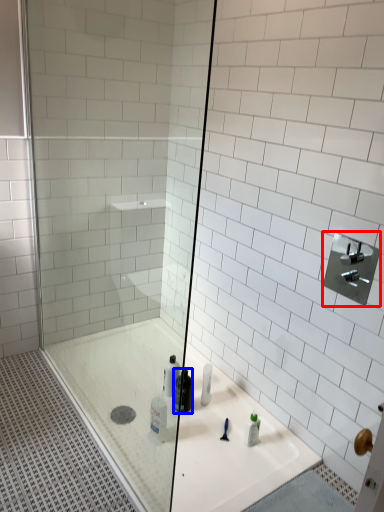
Question: Which point is closer to the camera, shower (highlighted by a red box) or mouthwash (highlighted by a blue box)?

Choices:
 (A) shower
 (B) mouthwash

Answer: (A)